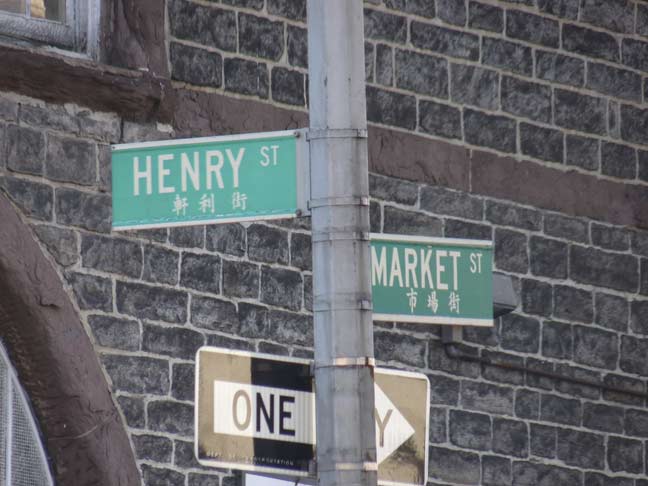
You are a GUI agent. You are given a task and a screenshot of the screen. Output one action in this format:
    pyautogui.click(x=<x>, y=<y>)
    Task: Click on the window
    
    Given the screenshot: What is the action you would take?
    pyautogui.click(x=37, y=27)